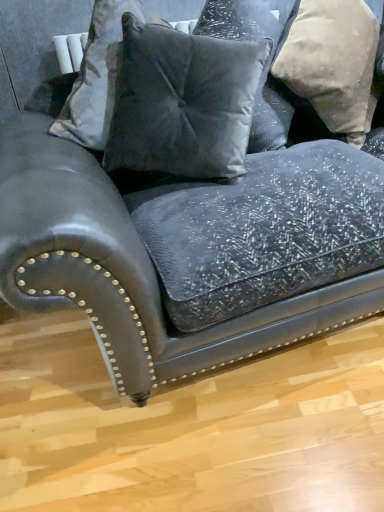
Question: Is beige textured pillow at upper right, positioned as the first pillow in right-to-left order, wider than velvet gray pillow at upper center, placed as the second pillow when sorted from left to right?

Choices:
 (A) yes
 (B) no

Answer: (A)

Question: Is beige textured pillow at upper right, positioned as the first pillow in right-to-left order, bigger than velvet gray pillow at upper center, placed as the second pillow when sorted from left to right?

Choices:
 (A) no
 (B) yes

Answer: (A)

Question: Is beige textured pillow at upper right, the third pillow positioned from the left, turned away from velvet gray pillow at upper center, which is the 2th pillow from right to left?

Choices:
 (A) no
 (B) yes

Answer: (A)

Question: Considering the relative positions of beige textured pillow at upper right, the third pillow positioned from the left, and velvet gray pillow at upper center, placed as the second pillow when sorted from left to right, in the image provided, is beige textured pillow at upper right, the third pillow positioned from the left, to the left of velvet gray pillow at upper center, placed as the second pillow when sorted from left to right, from the viewer's perspective?

Choices:
 (A) no
 (B) yes

Answer: (A)

Question: Considering the relative sizes of beige textured pillow at upper right, positioned as the first pillow in right-to-left order, and velvet gray pillow at upper center, which is the 2th pillow from right to left, in the image provided, is beige textured pillow at upper right, positioned as the first pillow in right-to-left order, smaller than velvet gray pillow at upper center, which is the 2th pillow from right to left,?

Choices:
 (A) yes
 (B) no

Answer: (A)

Question: From the image's perspective, is velvet gray pillow at center, which is counted as the 3th pillow, starting from the right, located above or below beige textured pillow at upper right, positioned as the first pillow in right-to-left order?

Choices:
 (A) below
 (B) above

Answer: (A)

Question: In the image, is velvet gray pillow at center, which is counted as the 3th pillow, starting from the right, positioned in front of or behind beige textured pillow at upper right, the third pillow positioned from the left?

Choices:
 (A) behind
 (B) front

Answer: (B)

Question: From a real-world perspective, is velvet gray pillow at center, the first pillow positioned from the left, above or below beige textured pillow at upper right, positioned as the first pillow in right-to-left order?

Choices:
 (A) below
 (B) above

Answer: (B)

Question: Is velvet gray pillow at center, the first pillow positioned from the left, wider or thinner than beige textured pillow at upper right, the third pillow positioned from the left?

Choices:
 (A) wide
 (B) thin

Answer: (B)

Question: From a real-world perspective, is beige textured pillow at upper right, positioned as the first pillow in right-to-left order, positioned above or below velvet gray pillow at upper center, which is the 2th pillow from right to left?

Choices:
 (A) above
 (B) below

Answer: (B)

Question: In terms of height, does beige textured pillow at upper right, positioned as the first pillow in right-to-left order, look taller or shorter compared to velvet gray pillow at upper center, placed as the second pillow when sorted from left to right?

Choices:
 (A) tall
 (B) short

Answer: (A)

Question: Considering the positions of beige textured pillow at upper right, positioned as the first pillow in right-to-left order, and velvet gray pillow at upper center, which is the 2th pillow from right to left, in the image, is beige textured pillow at upper right, positioned as the first pillow in right-to-left order, wider or thinner than velvet gray pillow at upper center, which is the 2th pillow from right to left,?

Choices:
 (A) thin
 (B) wide

Answer: (B)

Question: Is beige textured pillow at upper right, positioned as the first pillow in right-to-left order, to the left or to the right of velvet gray pillow at upper center, placed as the second pillow when sorted from left to right, in the image?

Choices:
 (A) right
 (B) left

Answer: (A)

Question: Looking at the image, does velvet gray pillow at center, which is counted as the 3th pillow, starting from the right, seem bigger or smaller compared to velvet gray pillow at upper center, placed as the second pillow when sorted from left to right?

Choices:
 (A) small
 (B) big

Answer: (A)

Question: From the image's perspective, relative to velvet gray pillow at upper center, which is the 2th pillow from right to left, is velvet gray pillow at center, the first pillow positioned from the left, above or below?

Choices:
 (A) above
 (B) below

Answer: (B)